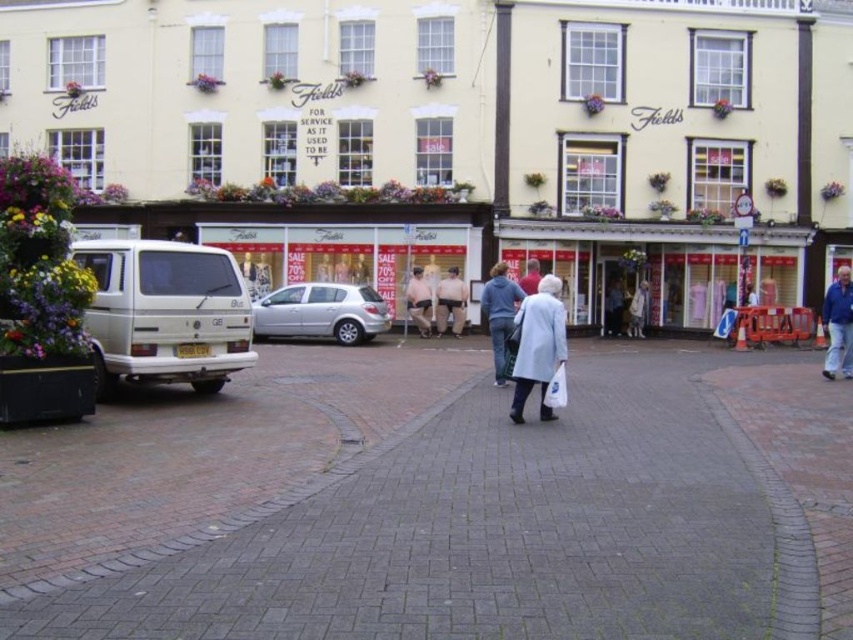
Question: Which point appears farthest from the camera in this image?

Choices:
 (A) (535, 284)
 (B) (436, 310)
 (C) (643, 294)
 (D) (833, 374)

Answer: (C)

Question: Where is white matte van at left located in relation to skinny white man at center in the image?

Choices:
 (A) above
 (B) below

Answer: (B)

Question: Is brick paved square at center positioned at the back of skinny white man at center?

Choices:
 (A) no
 (B) yes

Answer: (A)

Question: Estimate the real-world distances between objects in this image. Which object is closer to the light beige fabric pants at center?

Choices:
 (A) light blue denim jacket at center
 (B) matte glass storefront at center
 (C) light gray coat at center
 (D) light blue coat at center

Answer: (B)

Question: Estimate the real-world distances between objects in this image. Which object is farther from the matte glass storefront at center?

Choices:
 (A) light beige fabric pants at center
 (B) brick paved square at center
 (C) white matte van at left

Answer: (C)

Question: In this image, where is matte glass storefront at center located relative to matte gray jacket at center?

Choices:
 (A) right
 (B) left

Answer: (A)